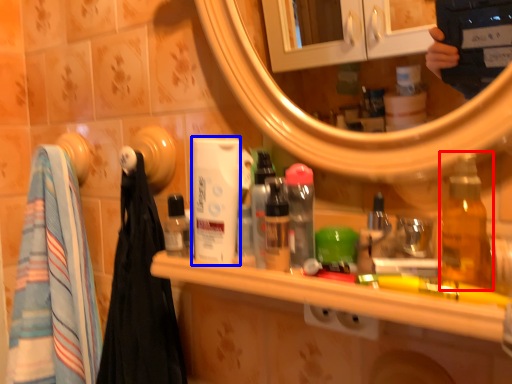
Question: Which of the following is the farthest to the observer, bottle (highlighted by a red box) or mouthwash (highlighted by a blue box)?

Choices:
 (A) bottle
 (B) mouthwash

Answer: (B)